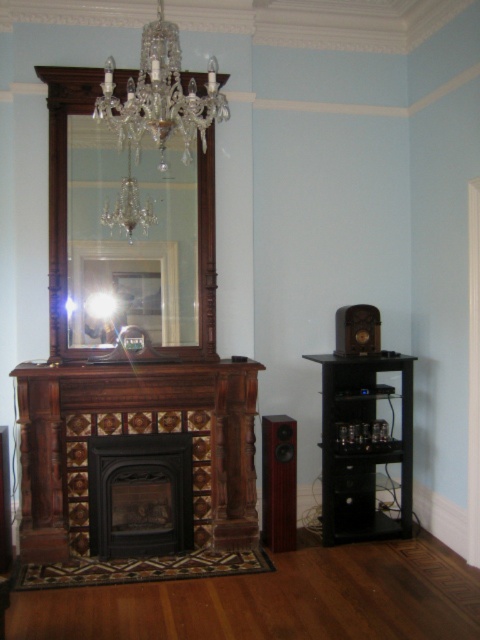
Does crystal glass mirror at upper center appear on the right side of brown wood/marble fireplace at center?

Incorrect, crystal glass mirror at upper center is not on the right side of brown wood/marble fireplace at center.

Between crystal glass mirror at upper center and brown wood/marble fireplace at center, which one has more height?

crystal glass mirror at upper center is taller.

Between point (74, 209) and point (44, 365), which one is positioned in front?

Positioned in front is point (44, 365).

The image size is (480, 640). What are the coordinates of `crystal glass mirror at upper center` in the screenshot? It's located at (129, 243).

Is the position of crystal glass mirror at upper center more distant than that of crystal glass chandelier at upper center?

Yes, it is.

Is point (143, 273) more distant than point (132, 136)?

Yes, point (143, 273) is farther from viewer.

Find the location of a particular element. crystal glass mirror at upper center is located at coordinates (129, 243).

Does black matte fireplace at center appear under clear crystal chandelier at upper center?

Correct, black matte fireplace at center is located below clear crystal chandelier at upper center.

Between black matte fireplace at center and clear crystal chandelier at upper center, which one is positioned higher?

clear crystal chandelier at upper center is above.

Which is in front, point (176, 474) or point (127, 209)?

Point (127, 209) is in front.

This screenshot has height=640, width=480. In order to click on black matte fireplace at center in this screenshot , I will do `click(140, 493)`.